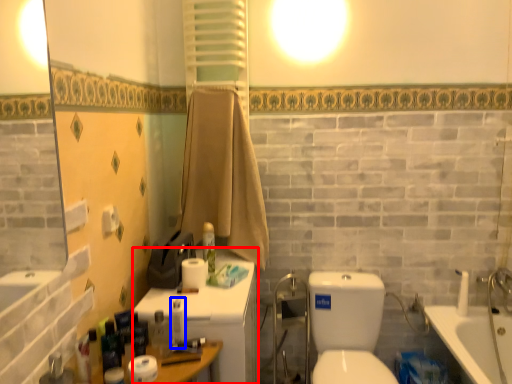
Question: Which of the following is the farthest to the observer, medicine cabinet (highlighted by a red box) or toiletry (highlighted by a blue box)?

Choices:
 (A) medicine cabinet
 (B) toiletry

Answer: (A)